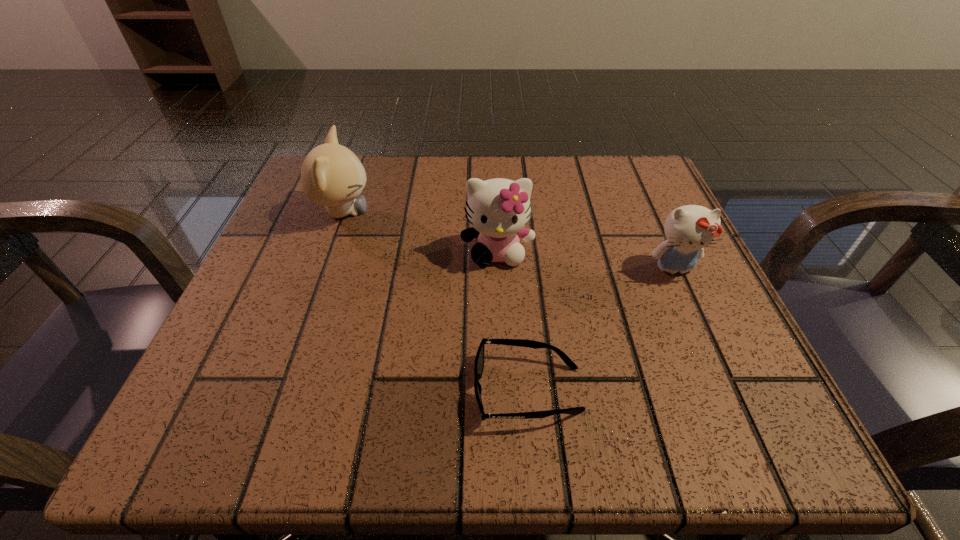
Find the location of a particular element. free space at the left edge of the desktop is located at coordinates (320, 307).

In the image, there is a desktop. Find the location of `vacant space at the right edge`. vacant space at the right edge is located at coordinates (660, 240).

This screenshot has width=960, height=540. What are the coordinates of `blank space at the far left corner of the desktop` in the screenshot? It's located at (293, 193).

Where is `free space at the near left corner of the desktop`? free space at the near left corner of the desktop is located at coordinates (205, 396).

In the image, there is a desktop. Identify the location of free space at the far right corner. (596, 199).

Find the location of a particular element. blank space at the near right corner of the desktop is located at coordinates (686, 444).

This screenshot has width=960, height=540. I want to click on free space between the second shortest object and the nearest object, so click(601, 329).

Locate an element on the screen. Image resolution: width=960 pixels, height=540 pixels. unoccupied position between the nearest object and the second kitten from right to left is located at coordinates (513, 321).

Where is `free point between the sunglasses and the leftmost kitten`? free point between the sunglasses and the leftmost kitten is located at coordinates pyautogui.click(x=435, y=301).

Locate an element on the screen. The height and width of the screenshot is (540, 960). free space between the shortest object and the rightmost object is located at coordinates (601, 329).